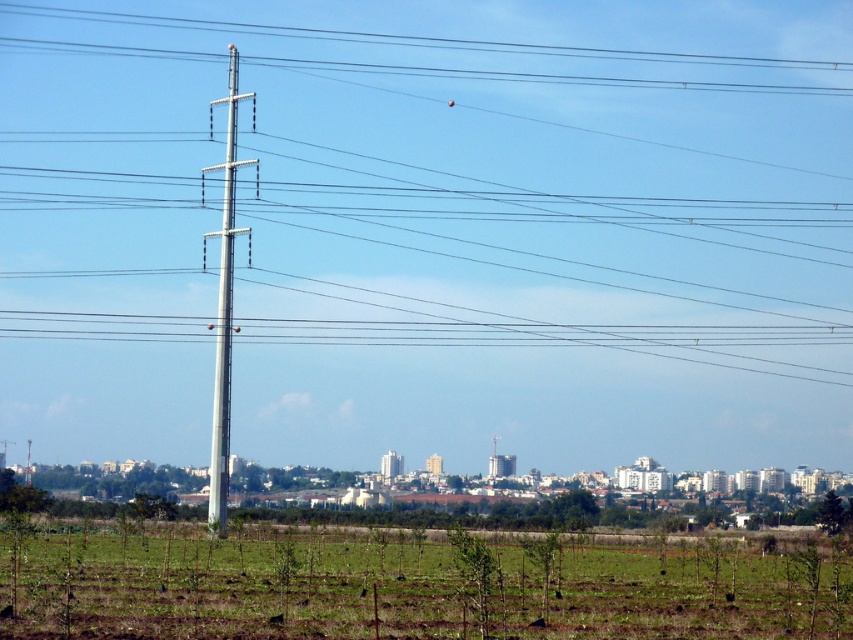
You are standing at the point closer to the camera between the two points, point (x=184, y=45) and point (x=213, y=474). Which point are you standing at?

You are standing at point (x=184, y=45) because it is further to the camera than point (x=213, y=474).

From the picture: You are a landscape architect assessing the rural area. You need to determine if the green grassy field at lower center can accommodate a new pathway that is as wide as the metallic gray telegraph pole at left. Based on their widths, can the field accommodate the pathway?

The green grassy field at lower center is wider than the metallic gray telegraph pole at left, so yes, the field can accommodate a pathway as wide as the telegraph pole.